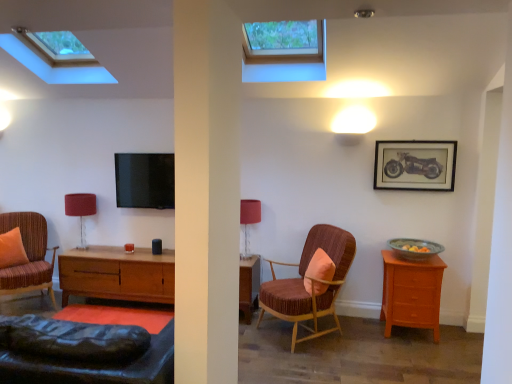
Question: Does orange fabric pillow at left, marked as the second pillow in a front-to-back arrangement, have a larger size compared to transparent glass window at upper center, the 2th window viewed from the left?

Choices:
 (A) no
 (B) yes

Answer: (A)

Question: Can you see orange fabric pillow at left, marked as the second pillow in a front-to-back arrangement, touching transparent glass window at upper center, marked as the 1th window in a right-to-left arrangement?

Choices:
 (A) yes
 (B) no

Answer: (B)

Question: Is orange fabric pillow at left, marked as the second pillow in a front-to-back arrangement, closer to the viewer compared to transparent glass window at upper center, marked as the 1th window in a right-to-left arrangement?

Choices:
 (A) yes
 (B) no

Answer: (B)

Question: Does orange fabric pillow at left, which is counted as the 2th pillow, starting from the right, turn towards transparent glass window at upper center, marked as the 1th window in a right-to-left arrangement?

Choices:
 (A) no
 (B) yes

Answer: (A)

Question: Considering the relative sizes of orange fabric pillow at left, marked as the 1th pillow in a back-to-front arrangement, and transparent glass window at upper center, marked as the 1th window in a right-to-left arrangement, in the image provided, is orange fabric pillow at left, marked as the 1th pillow in a back-to-front arrangement, thinner than transparent glass window at upper center, marked as the 1th window in a right-to-left arrangement,?

Choices:
 (A) yes
 (B) no

Answer: (A)

Question: From a real-world perspective, is orange fabric pillow at left, which is counted as the 2th pillow, starting from the right, under transparent glass window at upper center, marked as the 1th window in a right-to-left arrangement?

Choices:
 (A) yes
 (B) no

Answer: (A)

Question: Can you confirm if velvet-like brown armchair at center, which is the second chair in left-to-right order, is wider than transparent glass window at upper center, marked as the 1th window in a right-to-left arrangement?

Choices:
 (A) no
 (B) yes

Answer: (A)

Question: From a real-world perspective, is velvet-like brown armchair at center, which is the second chair in left-to-right order, positioned over transparent glass window at upper center, marked as the 1th window in a right-to-left arrangement, based on gravity?

Choices:
 (A) no
 (B) yes

Answer: (A)

Question: Considering the relative sizes of velvet-like brown armchair at center, the 1th chair viewed from the right, and transparent glass window at upper center, the 2th window viewed from the left, in the image provided, is velvet-like brown armchair at center, the 1th chair viewed from the right, thinner than transparent glass window at upper center, the 2th window viewed from the left,?

Choices:
 (A) no
 (B) yes

Answer: (B)

Question: Is velvet-like brown armchair at center, which is the second chair in left-to-right order, not close to transparent glass window at upper center, marked as the 1th window in a right-to-left arrangement?

Choices:
 (A) yes
 (B) no

Answer: (A)

Question: Does velvet-like brown armchair at center, the 1th chair viewed from the right, have a lesser height compared to transparent glass window at upper center, marked as the 1th window in a right-to-left arrangement?

Choices:
 (A) no
 (B) yes

Answer: (A)

Question: Is transparent glass window at upper center, the 2th window viewed from the left, surrounded by velvet-like brown armchair at center, the 1th chair viewed from the right?

Choices:
 (A) no
 (B) yes

Answer: (A)

Question: Is matte red table lamp at center, which appears as the 2th table lamp when viewed from the left, to the left of light brown wood nightstand at right from the viewer's perspective?

Choices:
 (A) no
 (B) yes

Answer: (B)